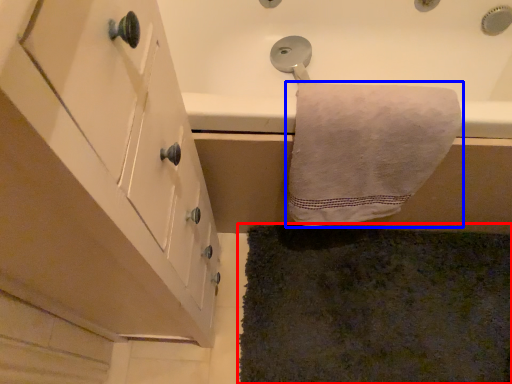
Question: Which object is closer to the camera taking this photo, bath mat (highlighted by a red box) or towel (highlighted by a blue box)?

Choices:
 (A) bath mat
 (B) towel

Answer: (B)